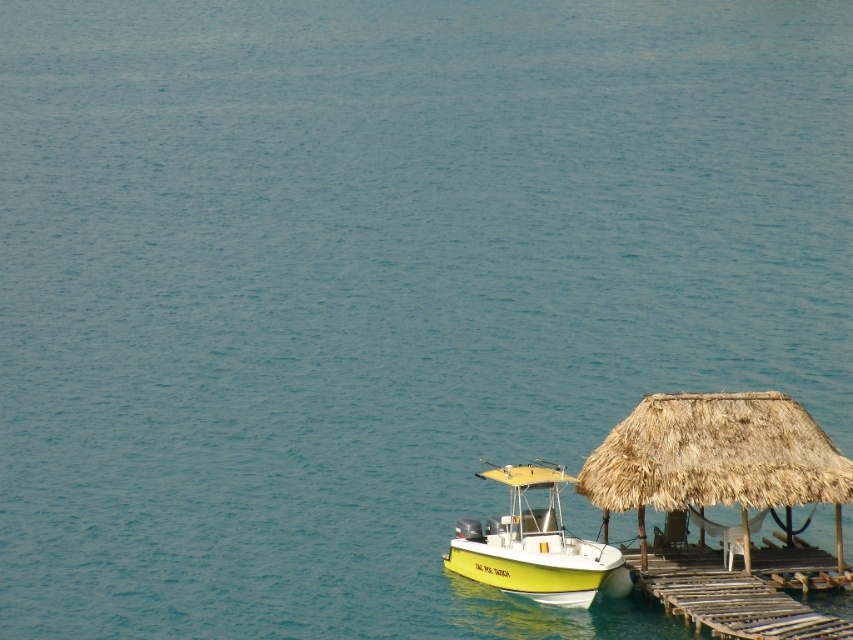
You are a photographer planning to capture a wide shot of the yellow matte boat at lower right and the wooden planks dock at lower right. Given their sizes, which object will appear bigger in the photo?

The yellow matte boat at lower right will appear bigger in the photo since it is larger in size than the wooden planks dock at lower right according to the description.

You are a boat operator who needs to secure the yellow matte boat at lower right to the wooden planks dock at lower right. The mooring rope you have is 3.5 meters long. Can you safely secure the boat with the available rope?

The yellow matte boat at lower right is 3.91 meters away from the wooden planks dock at lower right. Since the rope is only 3.5 meters long, it is not long enough to reach the dock. You will need a longer rope to secure the boat safely.